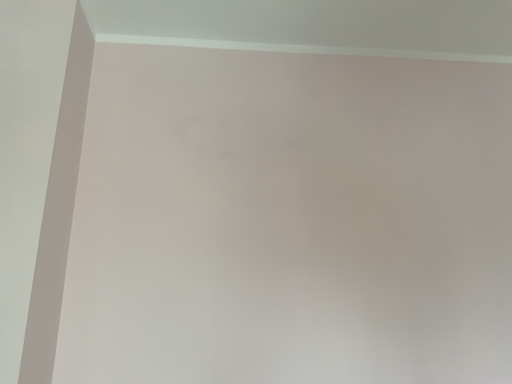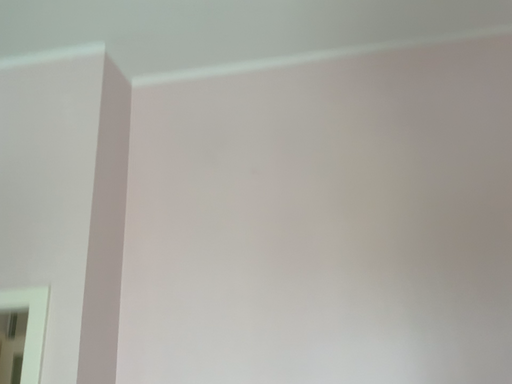
Question: Which way did the camera rotate in the video?

Choices:
 (A) rotated right
 (B) rotated left

Answer: (B)